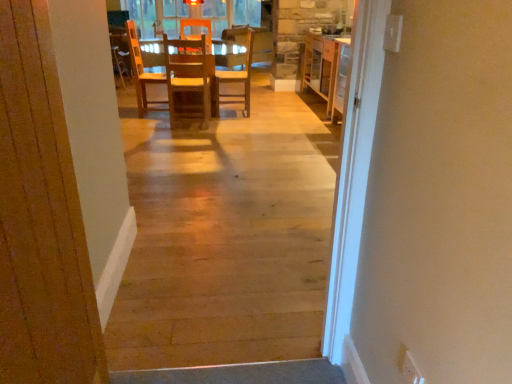
Locate an element on the screen. wooden chair at center, acting as the first chair starting from the left is located at coordinates (187, 81).

Where is `wooden door at center`? The height and width of the screenshot is (384, 512). wooden door at center is located at coordinates (41, 218).

From a real-world perspective, does wooden door at center sit lower than natural wood floor at center?

No, from a real-world perspective, wooden door at center is not below natural wood floor at center.

Which is in front, point (42, 116) or point (163, 159)?

Positioned in front is point (42, 116).

Are wooden door at center and natural wood floor at center far apart?

Yes, wooden door at center is far from natural wood floor at center.

Based on the photo, from a real-world perspective, is wooden cabinet at center on top of wooden door at center?

No.

Which is closer, (338, 48) or (59, 221)?

The point (59, 221) is closer to the camera.

Is wooden cabinet at center not near wooden door at center?

wooden cabinet at center is positioned a significant distance from wooden door at center.

Is wooden door at center turned away from wooden chair at center, acting as the first chair starting from the left?

That's not correct — wooden door at center is not looking away from wooden chair at center, acting as the first chair starting from the left.

Can you tell me how much wooden door at center and wooden chair at center, acting as the first chair starting from the left, differ in facing direction?

The angle between the facing direction of wooden door at center and the facing direction of wooden chair at center, acting as the first chair starting from the left, is 86.7 degrees.

Looking at their sizes, would you say wooden door at center is wider or thinner than wooden chair at center, acting as the 2th chair starting from the right?

Clearly, wooden door at center has less width compared to wooden chair at center, acting as the 2th chair starting from the right.

Find the location of `the 1st chair located beneath the wooden door at center (from a real-world perspective)`. the 1st chair located beneath the wooden door at center (from a real-world perspective) is located at coordinates (187, 81).

Does wooden armchair at upper left touch wooden chair at center, positioned as the 2th chair in left-to-right order?

No, wooden armchair at upper left is not next to wooden chair at center, positioned as the 2th chair in left-to-right order.

From a real-world perspective, is wooden armchair at upper left positioned above or below wooden chair at center, positioned as the 2th chair in left-to-right order?

wooden armchair at upper left is situated lower than wooden chair at center, positioned as the 2th chair in left-to-right order, in the real world.

Can you confirm if wooden armchair at upper left is positioned to the right of wooden chair at center, positioned as the 2th chair in left-to-right order?

No.

Which point is more distant from viewer, (116, 47) or (246, 94)?

The point (116, 47) is more distant.

Consider the image. Which is closer, (112, 57) or (74, 341)?

Clearly, point (112, 57) is more distant from the camera than point (74, 341).

Is wooden armchair at upper left spatially inside wooden door at center, or outside of it?

wooden armchair at upper left is spatially situated outside wooden door at center.

From their relative heights in the image, would you say wooden armchair at upper left is taller or shorter than wooden door at center?

wooden armchair at upper left is shorter than wooden door at center.

Is wooden armchair at upper left smaller than wooden door at center?

Incorrect, wooden armchair at upper left is not smaller in size than wooden door at center.

Are wooden cabinet at center and natural wood floor at center far apart?

Yes, wooden cabinet at center and natural wood floor at center are located far from each other.

Between wooden cabinet at center and natural wood floor at center, which one has smaller size?

Smaller between the two is natural wood floor at center.

Considering the relative sizes of wooden cabinet at center and natural wood floor at center in the image provided, is wooden cabinet at center taller than natural wood floor at center?

No, wooden cabinet at center is not taller than natural wood floor at center.

From a real-world perspective, is wooden cabinet at center physically located above or below natural wood floor at center?

In terms of real-world spatial position, wooden cabinet at center is below natural wood floor at center.

Is wooden chair at center, positioned as the 2th chair in left-to-right order, spatially inside wooden chair at center, acting as the first chair starting from the left, or outside of it?

wooden chair at center, positioned as the 2th chair in left-to-right order, lies outside wooden chair at center, acting as the first chair starting from the left.

Does wooden chair at center, positioned as the 2th chair in left-to-right order, turn towards wooden chair at center, acting as the first chair starting from the left?

No.

Can you confirm if wooden chair at center, acting as the first chair starting from the right, is positioned to the left of wooden chair at center, acting as the first chair starting from the left?

In fact, wooden chair at center, acting as the first chair starting from the right, is to the right of wooden chair at center, acting as the first chair starting from the left.

Between point (223, 94) and point (206, 97), which one is positioned in front?

Positioned in front is point (206, 97).

The image size is (512, 384). Identify the location of door below the natural wood floor at center (from the image's perspective). (41, 218).

I want to click on cabinetry on the right of wooden door at center, so click(x=326, y=70).

When comparing their distances from natural wood floor at center, does wooden door at center or wooden cabinet at center seem further?

Based on the image, wooden cabinet at center appears to be further to natural wood floor at center.

Based on their spatial positions, is wooden chair at center, acting as the 2th chair starting from the right, or wooden cabinet at center further from natural wood floor at center?

Among the two, wooden cabinet at center is located further to natural wood floor at center.

Estimate the real-world distances between objects in this image. Which object is further from wooden door at center, wooden chair at center, acting as the 2th chair starting from the right, or wooden armchair at upper left?

wooden armchair at upper left.

Looking at the image, which one is located closer to natural wood floor at center, wooden cabinet at center or wooden chair at center, acting as the first chair starting from the right?

wooden chair at center, acting as the first chair starting from the right, is closer to natural wood floor at center.

Based on their spatial positions, is wooden armchair at upper left or wooden cabinet at center further from natural wood floor at center?

wooden armchair at upper left lies further to natural wood floor at center than the other object.

From the image, which object appears to be farther from wooden door at center, wooden armchair at upper left or wooden chair at center, acting as the first chair starting from the right?

wooden armchair at upper left.

Considering their positions, is natural wood floor at center positioned closer to wooden cabinet at center than wooden chair at center, acting as the first chair starting from the right?

wooden chair at center, acting as the first chair starting from the right, is closer to wooden cabinet at center.

Based on their spatial positions, is wooden armchair at upper left or wooden chair at center, acting as the first chair starting from the right, closer to wooden cabinet at center?

The object closer to wooden cabinet at center is wooden chair at center, acting as the first chair starting from the right.

Locate an element on the screen. The height and width of the screenshot is (384, 512). chair located between wooden door at center and wooden chair at center, acting as the first chair starting from the right, in the depth direction is located at coordinates (187, 81).

The image size is (512, 384). In order to click on chair between wooden chair at center, acting as the 2th chair starting from the right, and wooden armchair at upper left from front to back in this screenshot , I will do `click(236, 81)`.

Find the location of `chair between natural wood floor at center and wooden chair at center, positioned as the 2th chair in left-to-right order, from front to back`. chair between natural wood floor at center and wooden chair at center, positioned as the 2th chair in left-to-right order, from front to back is located at coordinates (187, 81).

The height and width of the screenshot is (384, 512). I want to click on alley positioned between wooden door at center and wooden chair at center, acting as the first chair starting from the left, from near to far, so click(226, 237).